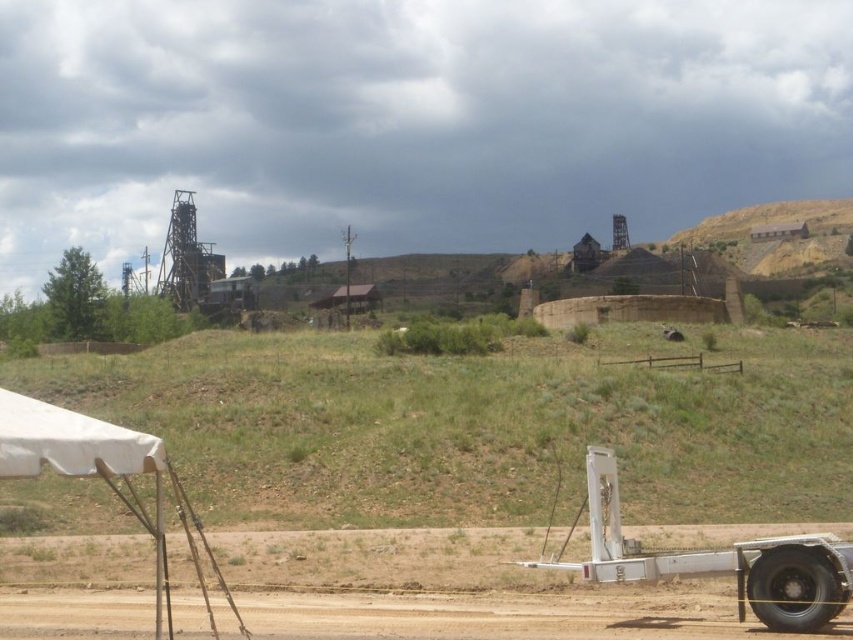
Question: Which is farther from the white metallic trailer truck at lower right?

Choices:
 (A) white canvas canopy at lower left
 (B) white fabric tent at lower left

Answer: (A)

Question: Observing the image, what is the correct spatial positioning of dirt track at lower left in reference to white canvas canopy at lower left?

Choices:
 (A) left
 (B) right

Answer: (B)

Question: Which object is farther from the camera taking this photo?

Choices:
 (A) white canvas canopy at lower left
 (B) dirt track at lower left
 (C) white metallic trailer truck at lower right
 (D) white fabric tent at lower left

Answer: (C)

Question: Is white metallic trailer truck at lower right further to camera compared to white canvas canopy at lower left?

Choices:
 (A) yes
 (B) no

Answer: (A)

Question: Is dirt track at lower left bigger than white fabric tent at lower left?

Choices:
 (A) no
 (B) yes

Answer: (A)

Question: Which point is closer to the camera taking this photo?

Choices:
 (A) (730, 547)
 (B) (44, 416)

Answer: (B)